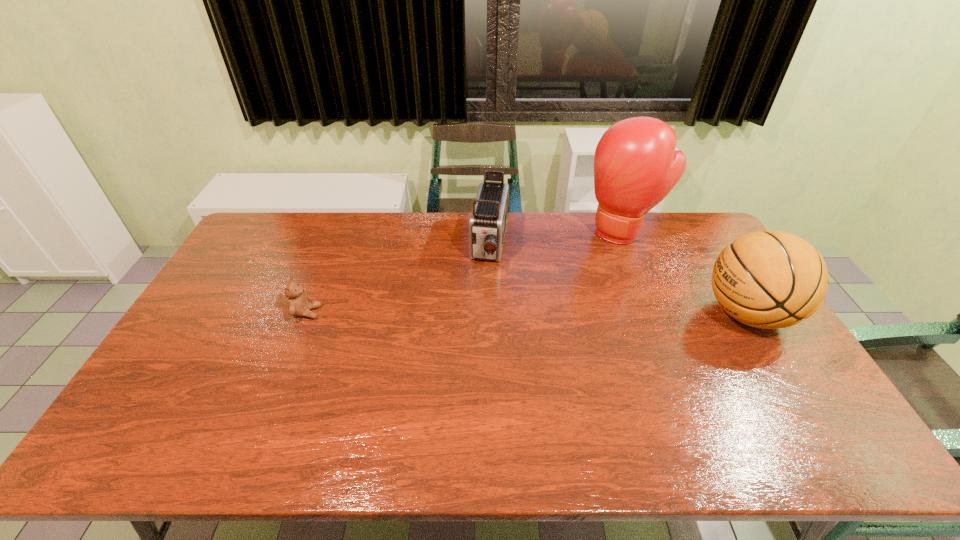
Locate an element on the screen. vacant space located 0.360m at the lens of the third object from right to left is located at coordinates coord(470,359).

You are a GUI agent. You are given a task and a screenshot of the screen. Output one action in this format:
    pyautogui.click(x=<x>, y=<y>)
    Task: Click on the free space located at the lens of the third object from right to left
    
    Given the screenshot: What is the action you would take?
    pyautogui.click(x=479, y=314)

The width and height of the screenshot is (960, 540). Identify the location of free spot located at the lens of the third object from right to left. (486, 284).

You are a GUI agent. You are given a task and a screenshot of the screen. Output one action in this format:
    pyautogui.click(x=<x>, y=<y>)
    Task: Click on the free space located 0.280m on the striking surface of the boxing glove
    
    Given the screenshot: What is the action you would take?
    pyautogui.click(x=569, y=294)

Identify the location of vacant space located 0.180m on the striking surface of the boxing glove. Image resolution: width=960 pixels, height=540 pixels. (583, 277).

At what (x,y) coordinates should I click in order to perform the action: click on free space located 0.210m on the striking surface of the boxing glove. Please return your answer as a coordinate pair (x, y). Looking at the image, I should click on (579, 282).

In order to click on camcorder that is at the far edge in this screenshot , I will do `click(487, 225)`.

Find the location of `boxing glove that is at the far edge`. boxing glove that is at the far edge is located at coordinates (636, 166).

Identify the location of object situated at the right edge. Image resolution: width=960 pixels, height=540 pixels. (771, 279).

Where is `vacant space at the far edge`? This screenshot has width=960, height=540. vacant space at the far edge is located at coordinates coord(381,212).